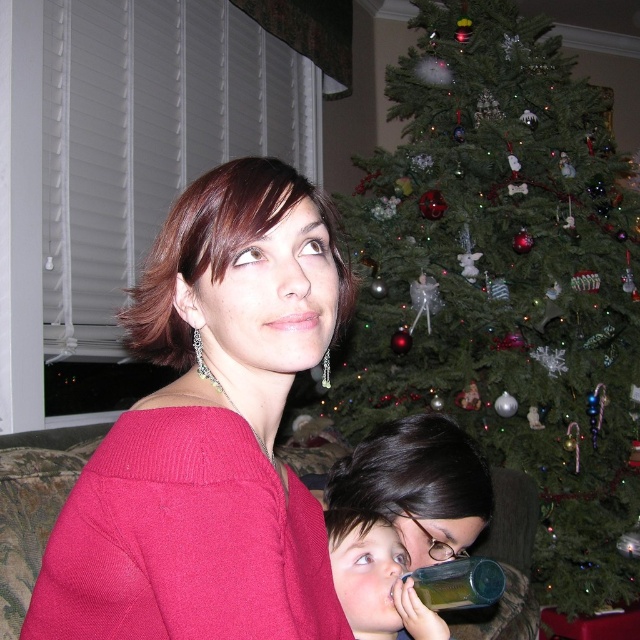
Does matte pink sweater at center have a lesser height compared to smooth plastic bottle at lower center?

No, matte pink sweater at center is not shorter than smooth plastic bottle at lower center.

Between point (243, 589) and point (364, 566), which one is positioned behind?

The point (364, 566) is more distant.

Does point (260, 614) come behind point (360, 516)?

No, it is in front of (360, 516).

Locate an element on the screen. matte pink sweater at center is located at coordinates (209, 433).

Does green matte christmas tree at upper center have a greater height compared to translucent plastic cup at lower center?

Correct, green matte christmas tree at upper center is much taller as translucent plastic cup at lower center.

Can you confirm if green matte christmas tree at upper center is shorter than translucent plastic cup at lower center?

No, green matte christmas tree at upper center is not shorter than translucent plastic cup at lower center.

At what (x,y) coordinates should I click in order to perform the action: click on green matte christmas tree at upper center. Please return your answer as a coordinate pair (x, y). The height and width of the screenshot is (640, 640). Looking at the image, I should click on (506, 280).

Does green matte christmas tree at upper center lie behind matte pink sweater at center?

Yes, green matte christmas tree at upper center is behind matte pink sweater at center.

Is green matte christmas tree at upper center closer to camera compared to matte pink sweater at center?

No, green matte christmas tree at upper center is further to the viewer.

Which is in front, point (445, 372) or point (113, 540)?

Point (113, 540) is more forward.

This screenshot has height=640, width=640. I want to click on green matte christmas tree at upper center, so click(506, 280).